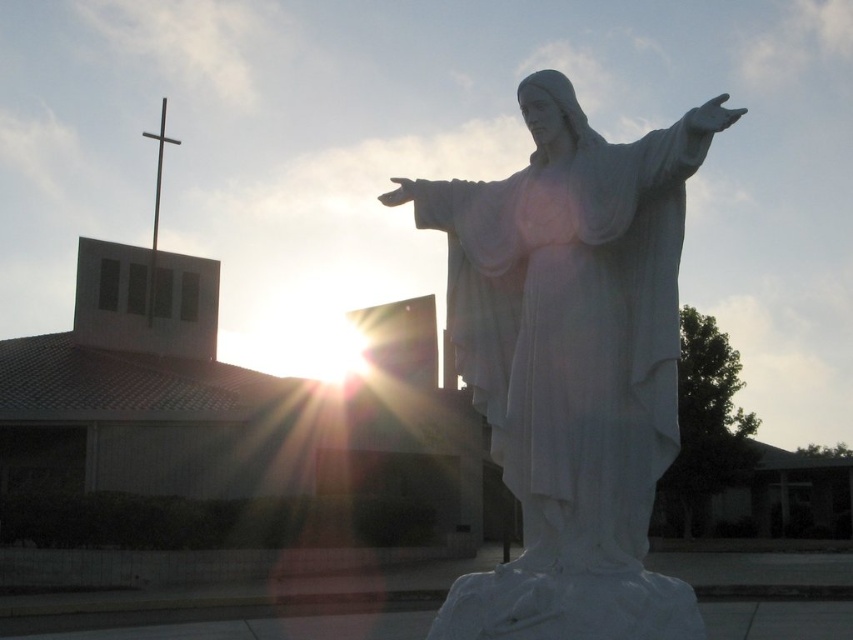
You are standing in front of the statue of Jesus Christ with outstretched arms and want to take a photo. There are two points marked on the statue at coordinates point (581, 280) and point (166, 99). Which point will appear larger in your photo?

Point (581, 280) will appear larger in the photo because it is closer to the camera than point (166, 99).

You are standing in front of a religious building and see the white marble statue at center and the metallic cross at upper left. Which object is positioned to the right of the other?

The white marble statue at center is positioned to the right of the metallic cross at upper left.